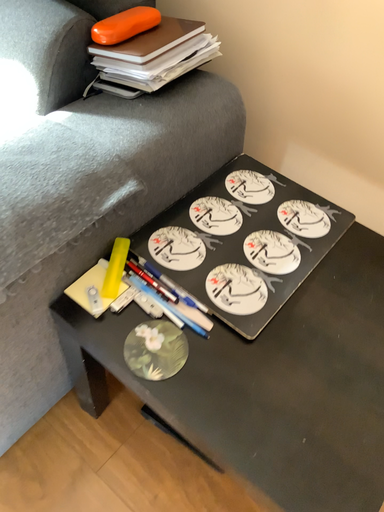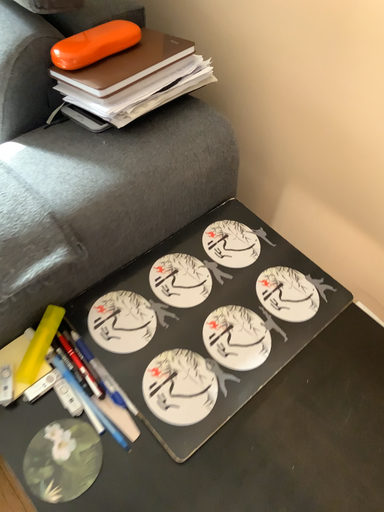
Question: Which way did the camera rotate in the video?

Choices:
 (A) rotated right
 (B) rotated left

Answer: (B)